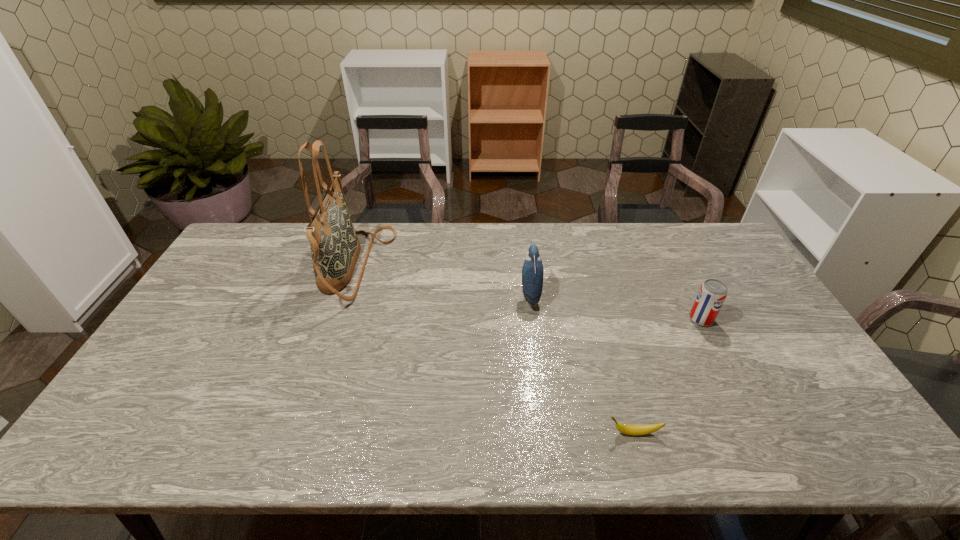
The height and width of the screenshot is (540, 960). Identify the location of vacant space located at the tip of the second object from left to right's beak. (392, 295).

The image size is (960, 540). I want to click on vacant space located 0.260m at the tip of the second object from left to right's beak, so click(437, 295).

Find the location of `vacant space located on the back of the rightmost object`. vacant space located on the back of the rightmost object is located at coordinates (672, 262).

Find the location of `free point located 0.130m at the stem of the second object from right to left`. free point located 0.130m at the stem of the second object from right to left is located at coordinates (550, 433).

You are a GUI agent. You are given a task and a screenshot of the screen. Output one action in this format:
    pyautogui.click(x=<x>, y=<y>)
    Task: Click on the vacant space located at the stem of the second object from right to left
    The image size is (960, 540).
    Given the screenshot: What is the action you would take?
    pyautogui.click(x=490, y=433)

Locate an element on the screen. This screenshot has width=960, height=540. free spot located 0.390m at the stem of the second object from right to left is located at coordinates [x=439, y=433].

Identify the location of object situated at the far edge. (335, 248).

Identify the location of object located at the near edge. (636, 430).

The image size is (960, 540). I want to click on free region at the far edge of the desktop, so click(x=414, y=249).

At what (x,y) coordinates should I click in order to perform the action: click on free space at the near edge of the desktop. Please return your answer as a coordinate pair (x, y). The width and height of the screenshot is (960, 540). Looking at the image, I should click on (732, 457).